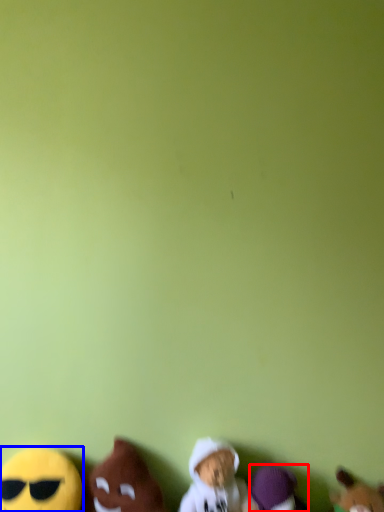
Question: Which point is further to the camera, toy (highlighted by a red box) or toy (highlighted by a blue box)?

Choices:
 (A) toy
 (B) toy

Answer: (A)